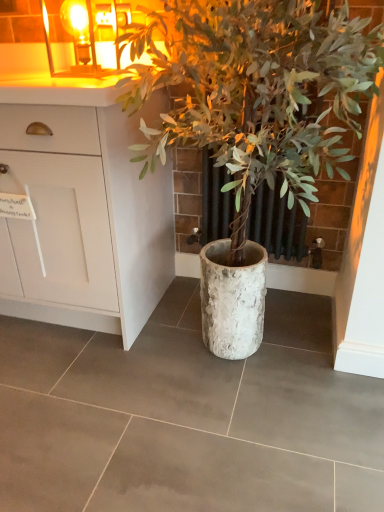
Question: Is white matte cabinet at upper left positioned before white textured pot at center?

Choices:
 (A) no
 (B) yes

Answer: (A)

Question: Considering the relative positions of white matte cabinet at upper left and white textured pot at center in the image provided, is white matte cabinet at upper left to the left of white textured pot at center from the viewer's perspective?

Choices:
 (A) no
 (B) yes

Answer: (B)

Question: Is white matte cabinet at upper left wider than white textured pot at center?

Choices:
 (A) no
 (B) yes

Answer: (B)

Question: Is there a large distance between white matte cabinet at upper left and white textured pot at center?

Choices:
 (A) no
 (B) yes

Answer: (A)

Question: From a real-world perspective, is white matte cabinet at upper left on white textured pot at center?

Choices:
 (A) no
 (B) yes

Answer: (A)

Question: From the image's perspective, is white matte cabinet at upper left located above or below amber glass candle at upper left?

Choices:
 (A) below
 (B) above

Answer: (A)

Question: Is white matte cabinet at upper left situated inside amber glass candle at upper left or outside?

Choices:
 (A) outside
 (B) inside

Answer: (A)

Question: From a real-world perspective, is white matte cabinet at upper left positioned above or below amber glass candle at upper left?

Choices:
 (A) below
 (B) above

Answer: (A)

Question: Is point (144, 281) closer or farther from the camera than point (104, 66)?

Choices:
 (A) closer
 (B) farther

Answer: (B)

Question: Relative to white matte cabinet at upper left, is white textured pot at center in front or behind?

Choices:
 (A) behind
 (B) front

Answer: (B)

Question: In the image, is white textured pot at center on the left side or the right side of white matte cabinet at upper left?

Choices:
 (A) right
 (B) left

Answer: (A)

Question: Is white textured pot at center taller or shorter than white matte cabinet at upper left?

Choices:
 (A) tall
 (B) short

Answer: (A)

Question: Is white textured pot at center spatially inside white matte cabinet at upper left, or outside of it?

Choices:
 (A) outside
 (B) inside

Answer: (A)

Question: Is amber glass candle at upper left spatially inside white matte cabinet at upper left, or outside of it?

Choices:
 (A) inside
 (B) outside

Answer: (B)

Question: In terms of width, does amber glass candle at upper left look wider or thinner when compared to white matte cabinet at upper left?

Choices:
 (A) thin
 (B) wide

Answer: (A)